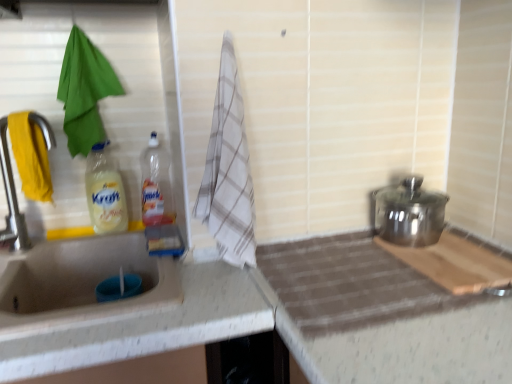
This screenshot has height=384, width=512. I want to click on free spot in front of white checkered towel at center, which appears as the 2th beach towel when viewed from the left, so (x=231, y=286).